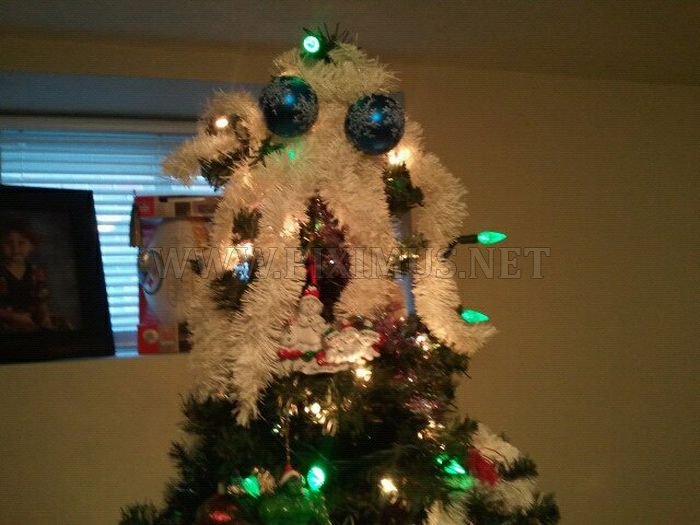
The width and height of the screenshot is (700, 525). Identify the location of ornaments. (302, 314), (340, 350).